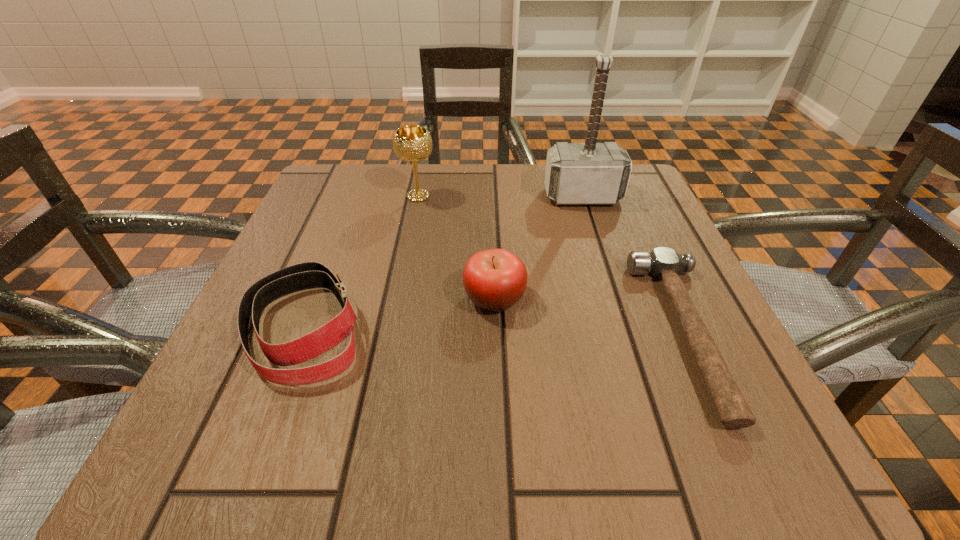
Where is `the second closest object to the third object from left to right`? the second closest object to the third object from left to right is located at coordinates (664, 263).

Where is `vacant space that satisfies the following two spatial constraints: 1. on the back side of the third tallest object; 2. on the right side of the second shortest object`? This screenshot has width=960, height=540. vacant space that satisfies the following two spatial constraints: 1. on the back side of the third tallest object; 2. on the right side of the second shortest object is located at coordinates (315, 299).